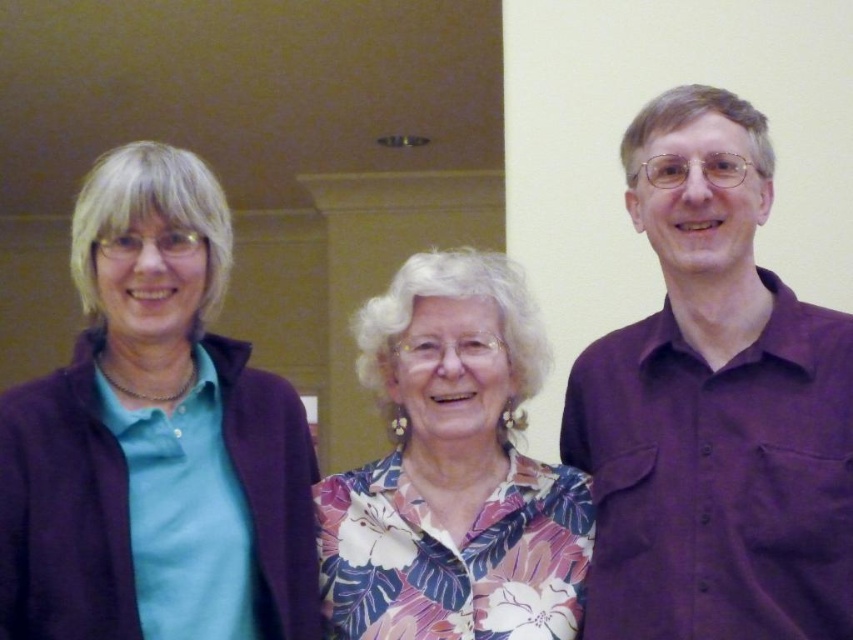
You are a photographer setting up for a group photo. You notice the purple cotton shirt at right and the floral print blouse at center. Which clothing item is closer to the camera?

The purple cotton shirt at right is in front of the floral print blouse at center, so it is closer to the camera.